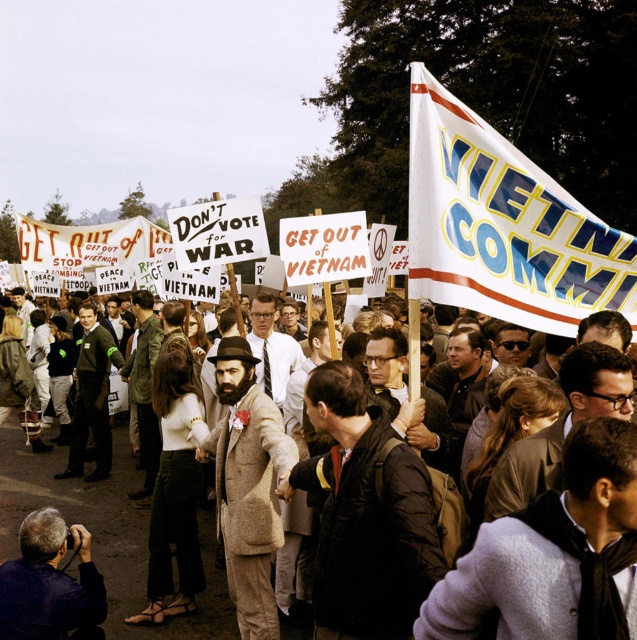
Question: Among these points, which one is nearest to the camera?

Choices:
 (A) (75, 634)
 (B) (124, 228)
 (C) (247, 403)

Answer: (A)

Question: Is gray fabric camera at lower left further to the viewer compared to white paper sign at left?

Choices:
 (A) no
 (B) yes

Answer: (A)

Question: Which object is closer to the camera taking this photo?

Choices:
 (A) white paper sign at left
 (B) beige wool coat at center
 (C) brown wool coat at center

Answer: (B)

Question: Is white paper flag at upper right positioned before beige wool coat at center?

Choices:
 (A) no
 (B) yes

Answer: (B)

Question: Which is nearer to the beige wool coat at center?

Choices:
 (A) white paper flag at upper right
 (B) gray fabric camera at lower left
 (C) white paper sign at left
 (D) brown wool coat at center

Answer: (B)

Question: Is brown wool coat at center bigger than gray fabric camera at lower left?

Choices:
 (A) yes
 (B) no

Answer: (B)